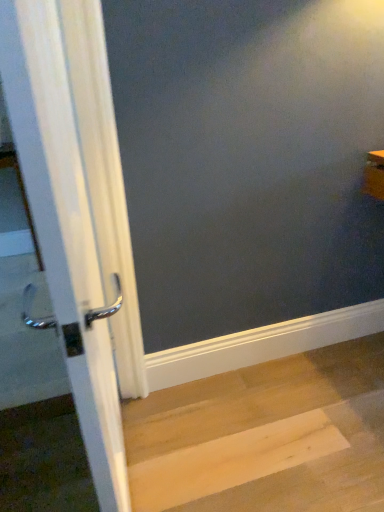
Locate an element on the screen. Image resolution: width=384 pixels, height=512 pixels. vacant area situated below white glossy door handle at left (from a real-world perspective) is located at coordinates coord(132,461).